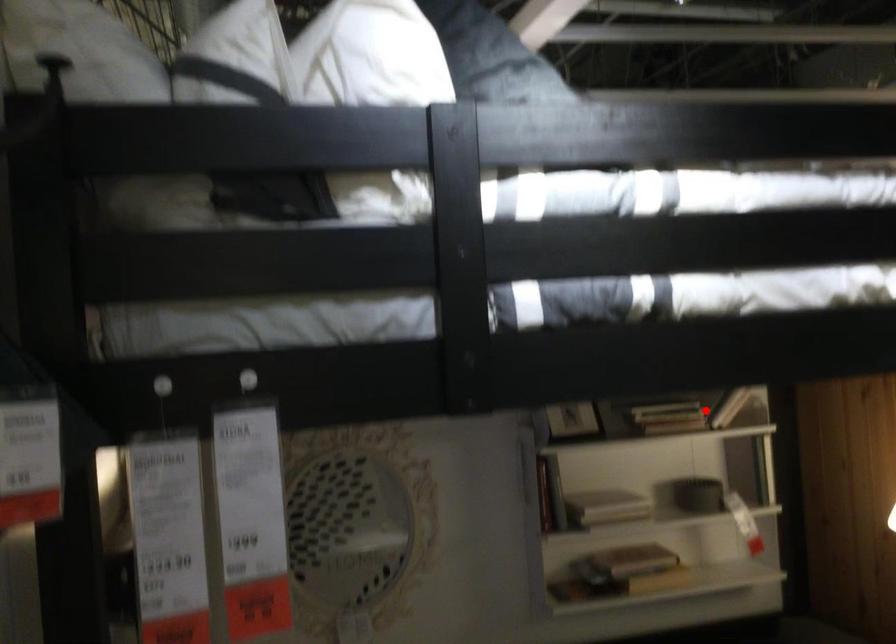
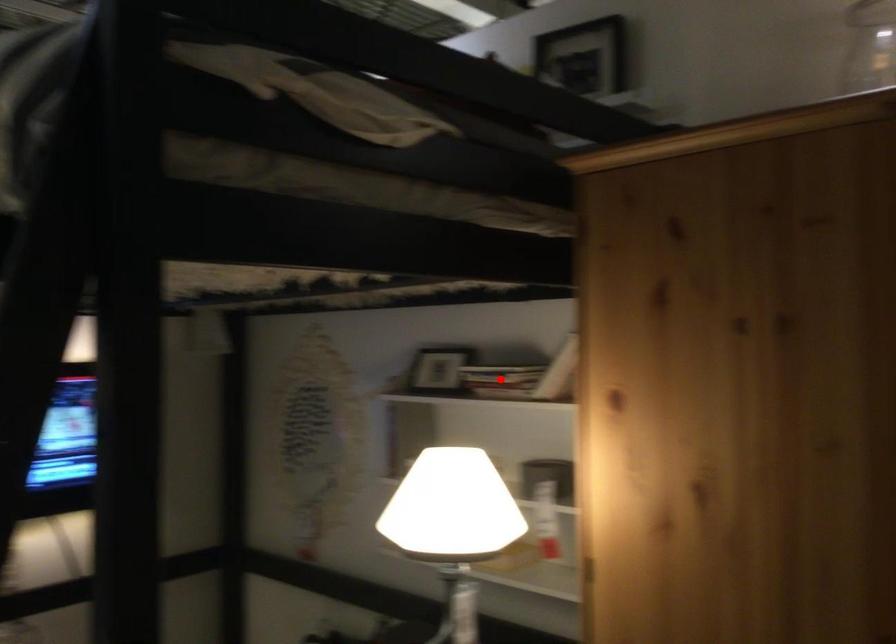
I am providing you with two images of the same scene from different viewpoints. A red point is marked on the first image and another point is marked on the second image. Is the marked point in image1 the same physical position as the marked point in image2?

Yes